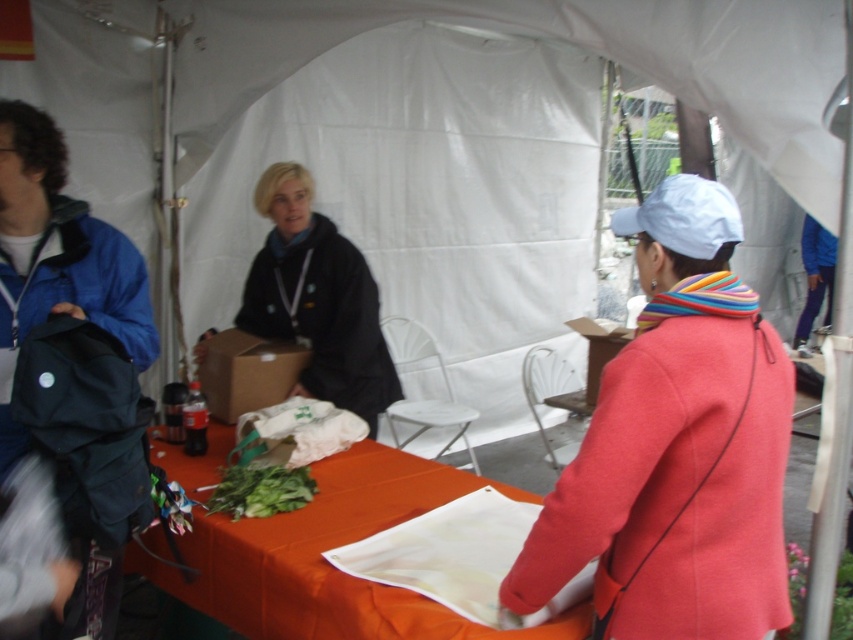
You are organizing items on a table under a white tent. You have a white matte cloth at center and a cardboard box at center. Which item takes up more space on the table?

The cardboard box at center occupies more space than the white matte cloth at center.